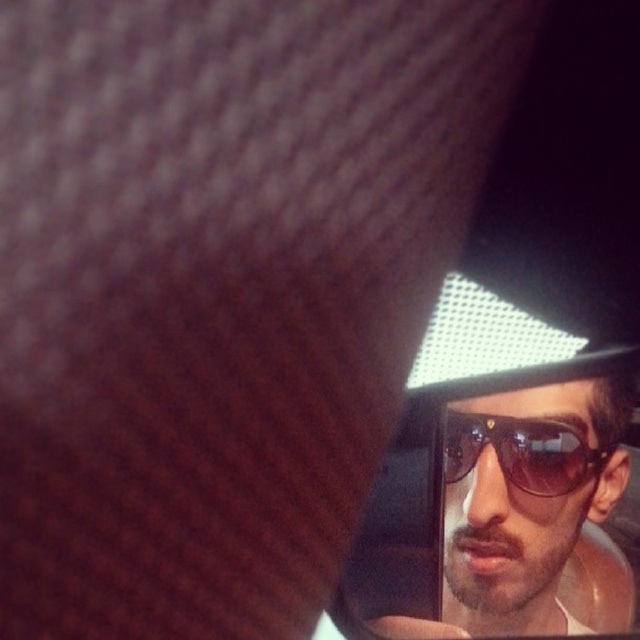
You are a photographer adjusting the focus on a camera. You notice two pairs of sunglasses in the frame, the sunglasses at upper right and the sunglasses at right. How far apart are these two pairs of sunglasses?

The sunglasses at upper right and sunglasses at right are 1.43 inches apart.

You are trying to determine which pair of sunglasses is closer to you in the image. You see the sunglasses at upper right and the sunglasses at right. Which one is closer?

The sunglasses at upper right is closer to you because it is in front of the sunglasses at right.